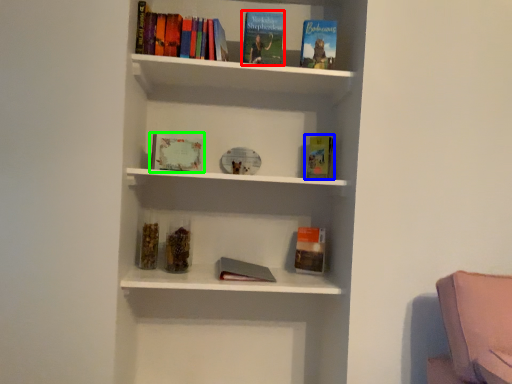
Question: Which is nearer to the book (highlighted by a red box)? paperback book (highlighted by a blue box) or book (highlighted by a green box).

Choices:
 (A) paperback book
 (B) book

Answer: (A)